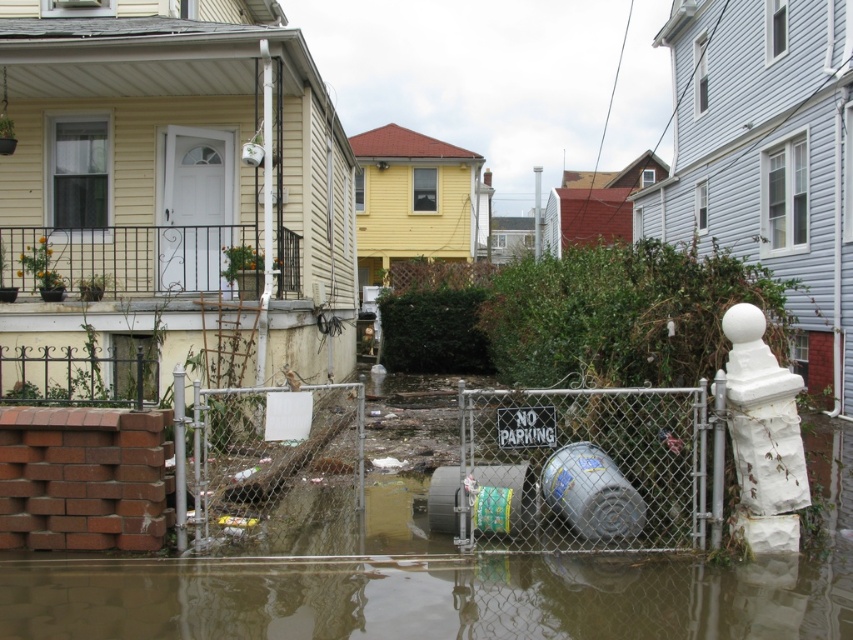
Question: Can you confirm if chain-link fence at center is thinner than brown murky water at lower center?

Choices:
 (A) yes
 (B) no

Answer: (A)

Question: Among these points, which one is nearest to the camera?

Choices:
 (A) (357, 570)
 (B) (515, 536)

Answer: (A)

Question: Is chain-link fence at center to the right of brown murky water at lower center from the viewer's perspective?

Choices:
 (A) no
 (B) yes

Answer: (B)

Question: Which object is closer to the camera taking this photo?

Choices:
 (A) chain-link fence at center
 (B) brown murky water at lower center

Answer: (B)

Question: Is chain-link fence at center above brown murky water at lower center?

Choices:
 (A) no
 (B) yes

Answer: (B)